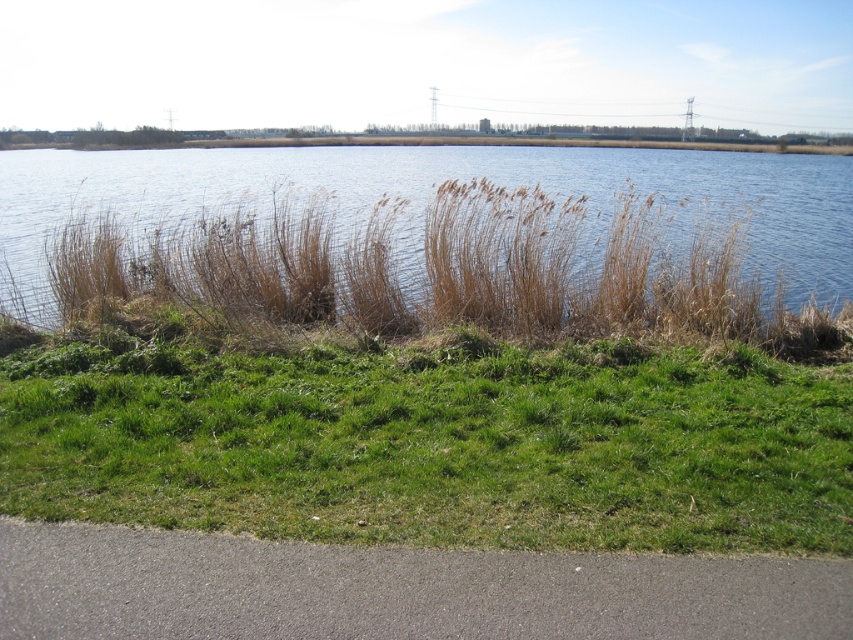
You are standing at the edge of the water in the serene natural scene. You see two points marked in the image. Which point is closer to you, point (306,179) or point (741,550)?

Point (306,179) is closer to you because it is further to the viewer than point (741,550).